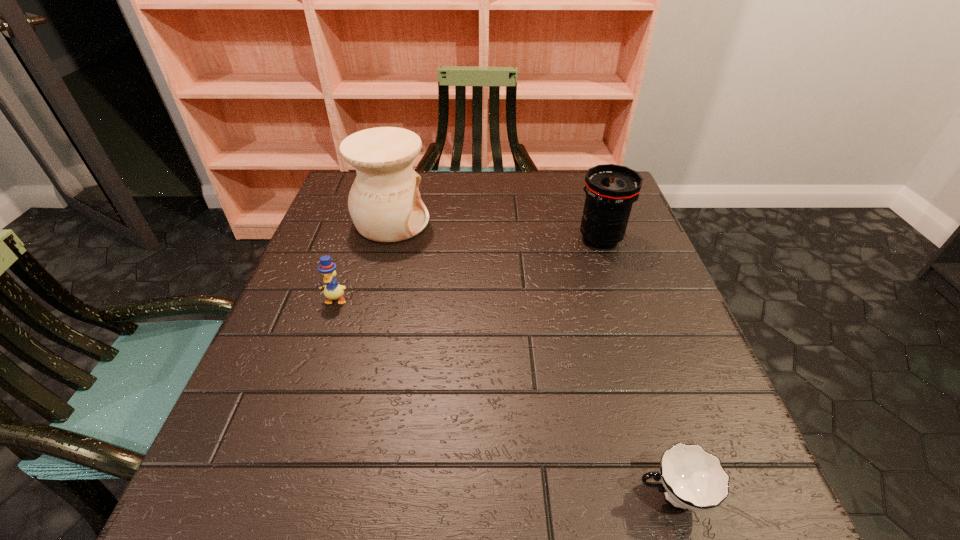
Where is `free space between the third shortest object and the cup`? free space between the third shortest object and the cup is located at coordinates (636, 367).

Identify the location of free space between the shortest object and the third shortest object. This screenshot has width=960, height=540. (636, 367).

This screenshot has height=540, width=960. I want to click on vacant area that lies between the third shortest object and the third tallest object, so tap(468, 269).

The width and height of the screenshot is (960, 540). Find the location of `free space between the telephoto lens and the cup`. free space between the telephoto lens and the cup is located at coordinates tap(636, 367).

Locate which object is the closest to the telephoto lens. Please provide its 2D coordinates. Your answer should be formatted as a tuple, i.e. [(x, y)], where the tuple contains the x and y coordinates of a point satisfying the conditions above.

[(384, 202)]

You are a GUI agent. You are given a task and a screenshot of the screen. Output one action in this format:
    pyautogui.click(x=<x>, y=<y>)
    Task: Click on the object that is the closest to the pottery
    Image resolution: width=960 pixels, height=540 pixels.
    Given the screenshot: What is the action you would take?
    pyautogui.click(x=327, y=268)

Where is `free space that satisfies the following two spatial constraints: 1. on the side of the third shortest object with the handle; 2. on the right side of the cup`? free space that satisfies the following two spatial constraints: 1. on the side of the third shortest object with the handle; 2. on the right side of the cup is located at coordinates (592, 239).

Where is `vacant space that satisfies the following two spatial constraints: 1. at the open side of the tallest object; 2. on the face of the third tallest object, where the monocle is placed`? Image resolution: width=960 pixels, height=540 pixels. vacant space that satisfies the following two spatial constraints: 1. at the open side of the tallest object; 2. on the face of the third tallest object, where the monocle is placed is located at coordinates (372, 300).

Find the location of a particular element. The width and height of the screenshot is (960, 540). vacant region that satisfies the following two spatial constraints: 1. on the side of the cup with the handle; 2. on the right side of the telephoto lens is located at coordinates (592, 239).

Locate an element on the screen. This screenshot has height=540, width=960. vacant point that satisfies the following two spatial constraints: 1. on the face of the third farthest object, where the monocle is placed; 2. on the side of the nearest object with the handle is located at coordinates (268, 495).